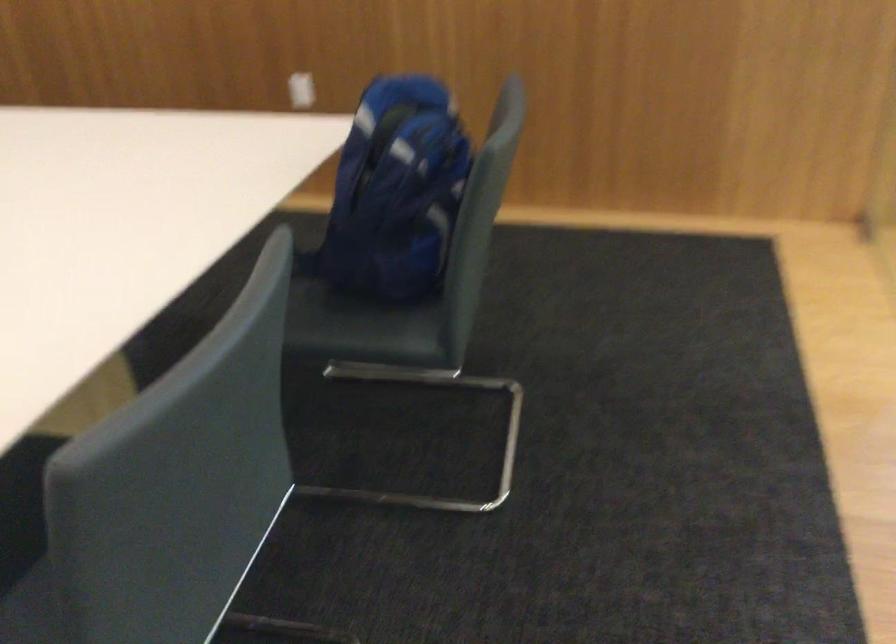
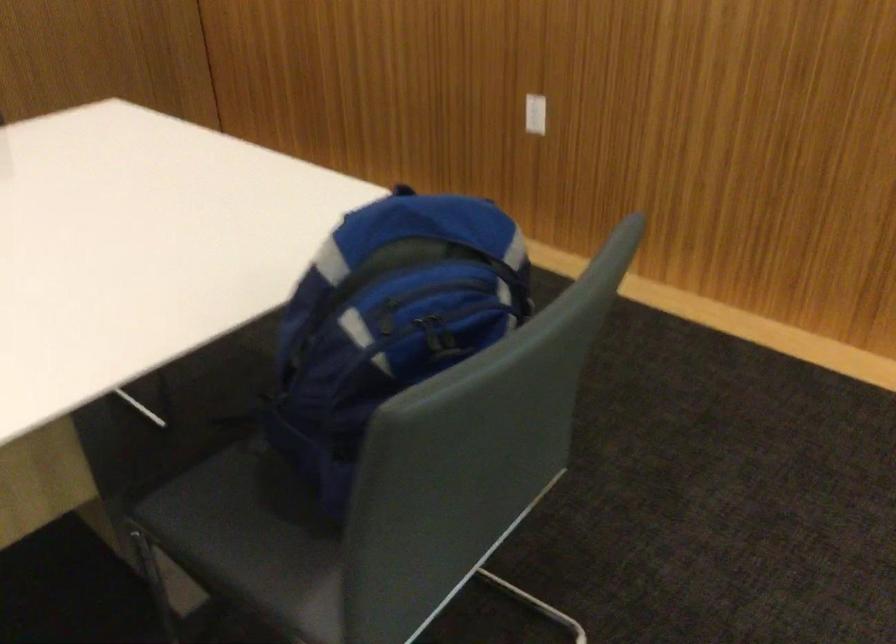
In a continuous first-person perspective shot, in which direction is the camera moving?

The movement direction of the cameraman is right, forward.